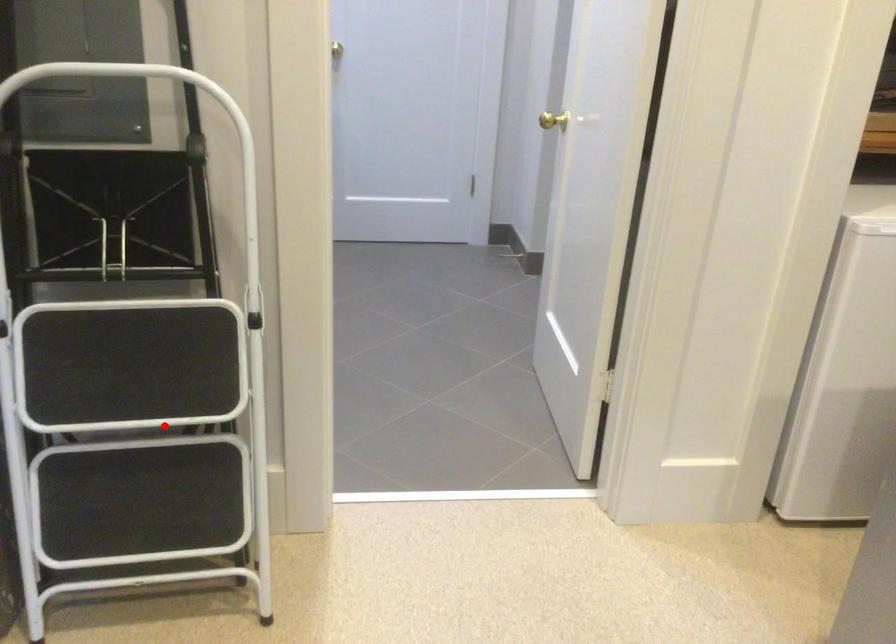
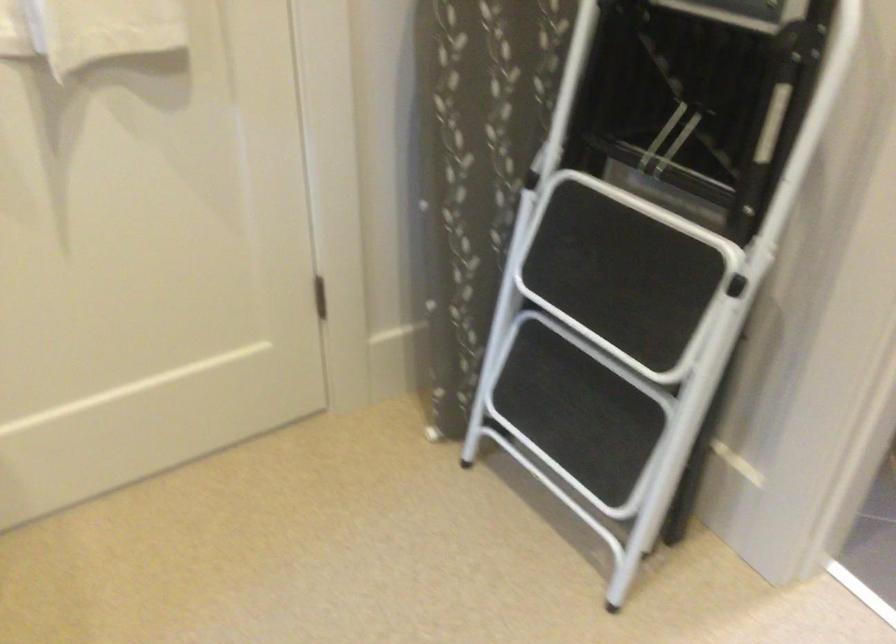
Where in the second image is the point corresponding to the highlighted location from the first image?

(607, 342)